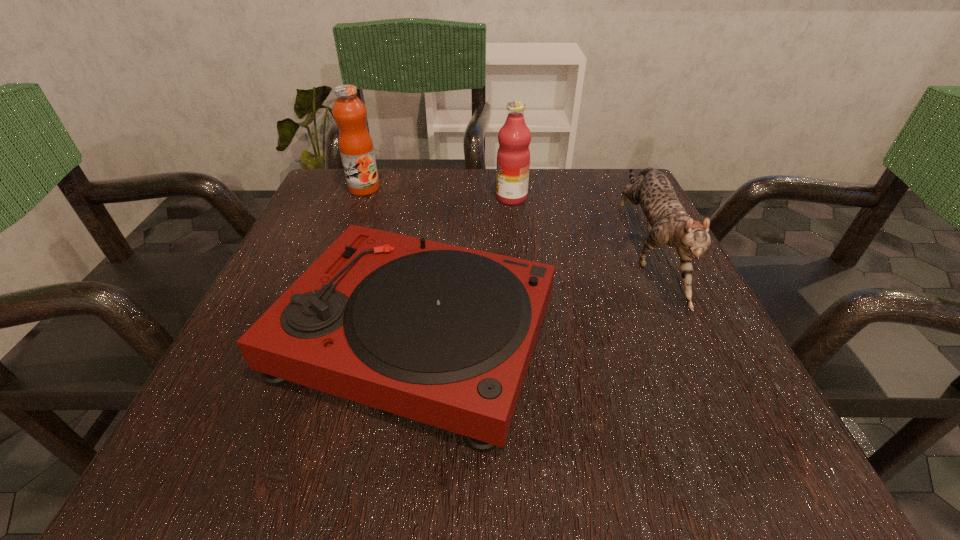
Where is `free spot at the near edge of the desktop`? free spot at the near edge of the desktop is located at coordinates (559, 434).

Locate an element on the screen. The height and width of the screenshot is (540, 960). vacant space at the right edge is located at coordinates coord(668,408).

At what (x,y) coordinates should I click in order to perform the action: click on vacant point at the far left corner. Please return your answer as a coordinate pair (x, y). This screenshot has width=960, height=540. Looking at the image, I should click on (372, 197).

I want to click on vacant space at the near right corner, so click(758, 476).

The height and width of the screenshot is (540, 960). What are the coordinates of `unoccupied position between the cat and the left fruit juice` in the screenshot? It's located at (505, 219).

In order to click on unoccupied area between the rightmost object and the right fruit juice in this screenshot , I will do `click(579, 224)`.

Where is `object that is the third closest to the shortest object`? Image resolution: width=960 pixels, height=540 pixels. object that is the third closest to the shortest object is located at coordinates (356, 148).

Identify which object is the closest to the left fruit juice. Please provide its 2D coordinates. Your answer should be formatted as a tuple, i.e. [(x, y)], where the tuple contains the x and y coordinates of a point satisfying the conditions above.

[(442, 334)]

The width and height of the screenshot is (960, 540). I want to click on free spot that satisfies the following two spatial constraints: 1. on the front label of the left fruit juice; 2. on the right side of the record player, so click(x=307, y=335).

At what (x,y) coordinates should I click in order to perform the action: click on free region that satisfies the following two spatial constraints: 1. on the front label of the shortest object; 2. on the right side of the left fruit juice. Please return your answer as a coordinate pair (x, y). Image resolution: width=960 pixels, height=540 pixels. Looking at the image, I should click on (307, 335).